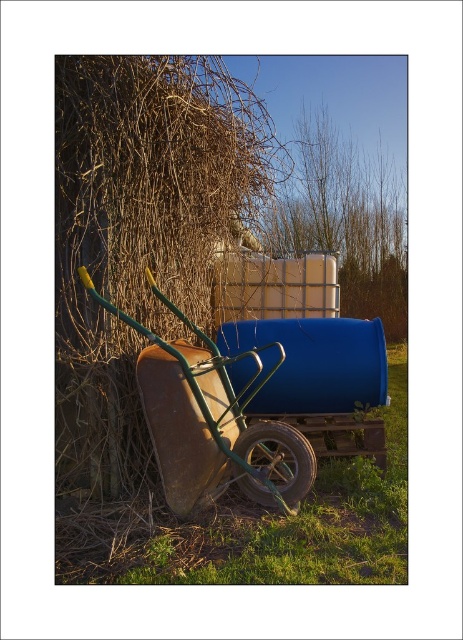
Does green grass at lower center have a smaller size compared to rusty metal cart at left?

No.

Can you confirm if green grass at lower center is positioned to the right of rusty metal cart at left?

Yes, green grass at lower center is to the right of rusty metal cart at left.

Is point (321, 572) positioned before point (167, 468)?

Yes, point (321, 572) is closer to viewer.

Where is `green grass at lower center`? Image resolution: width=463 pixels, height=640 pixels. green grass at lower center is located at coordinates (260, 518).